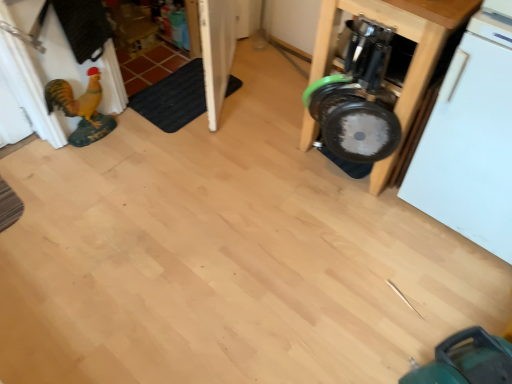
Find the location of a particular element. This screenshot has height=384, width=512. free region on the left part of white matte dishwasher at right is located at coordinates (361, 238).